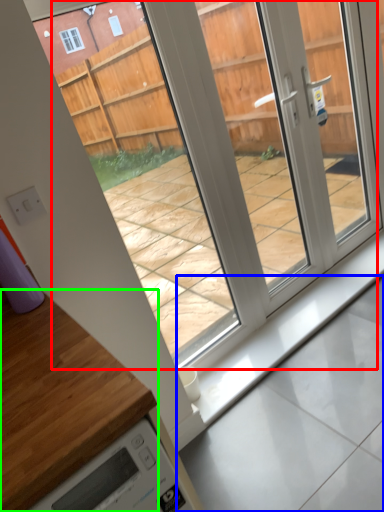
Question: Which object is the closest to the glass door (highlighted by a red box)? Choose among these: concrete (highlighted by a blue box) or countertop (highlighted by a green box).

Choices:
 (A) concrete
 (B) countertop

Answer: (A)